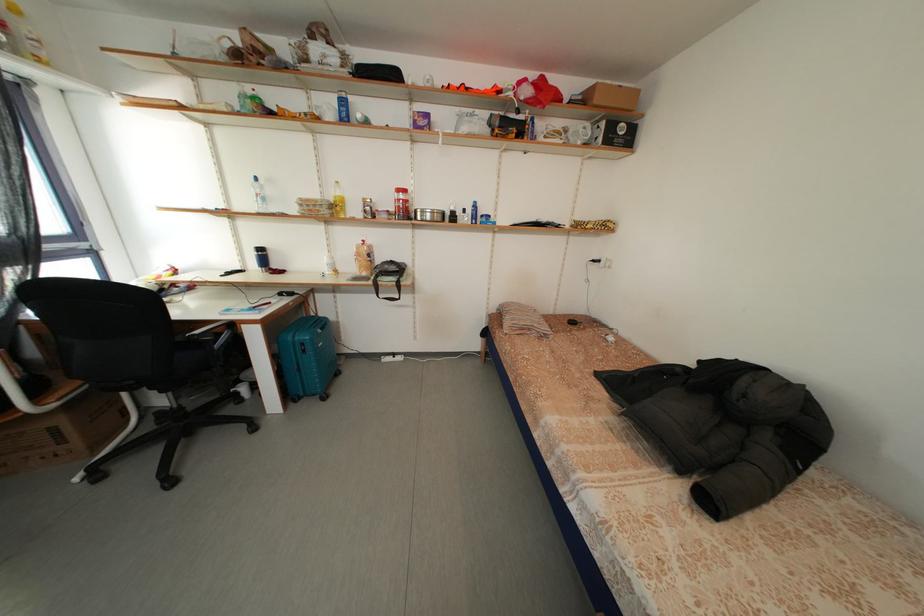
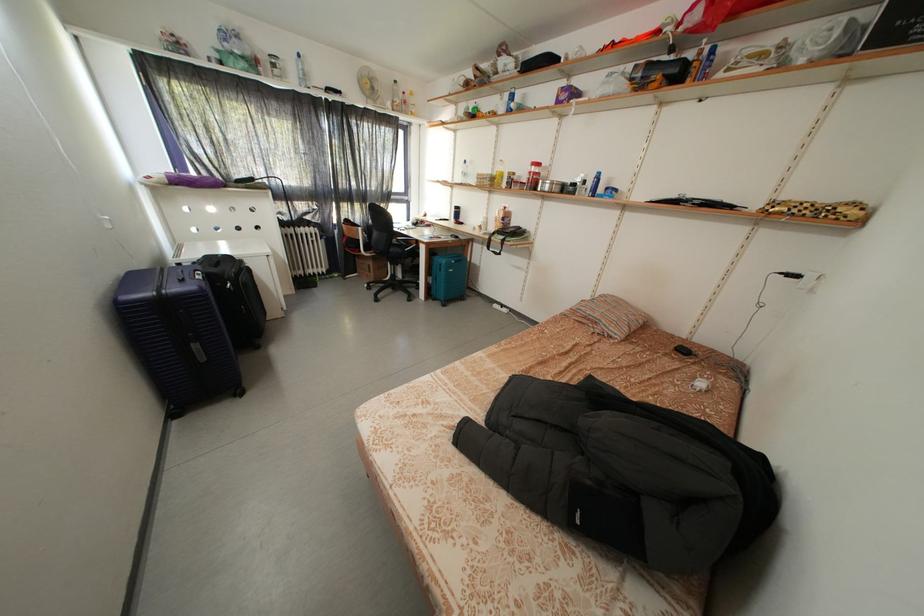
Where in the second image is the point corresponding to the point at 264,185 from the first image?

(472, 167)